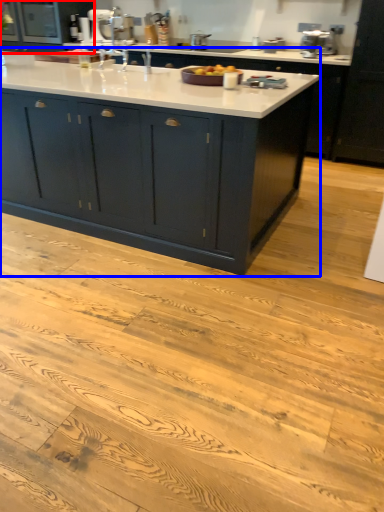
Question: Among these objects, which one is nearest to the camera, cabinetry (highlighted by a red box) or cabinetry (highlighted by a blue box)?

Choices:
 (A) cabinetry
 (B) cabinetry

Answer: (B)